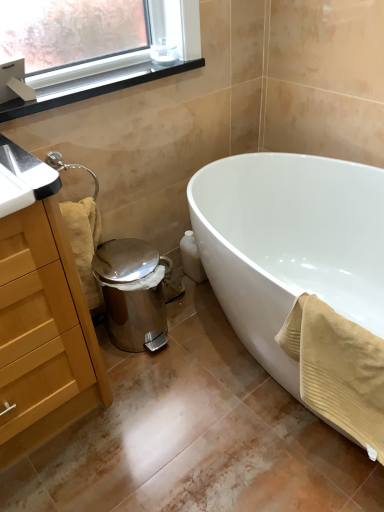
I want to click on wooden cabinet at left, so click(x=43, y=330).

Measure the distance between point (54,426) and camera.

1.43 meters.

At what (x,y) coordinates should I click in order to perform the action: click on black plastic window sill at upper left. Please return your answer as a coordinate pair (x, y). Looking at the image, I should click on (93, 87).

In order to face black plastic window sill at upper left, should I rotate leftwards or rightwards?

To align with it, rotate left about 11.834°.

Describe the element at coordinates (84, 243) in the screenshot. The width and height of the screenshot is (384, 512). I see `beige textured towel at lower left, positioned as the second bath towel in front-to-back order` at that location.

The image size is (384, 512). What are the coordinates of `wooden cabinet at left` in the screenshot? It's located at (43, 330).

Does white glossy bathtub at lower right have a smaller size compared to black plastic window sill at upper left?

Actually, white glossy bathtub at lower right might be larger than black plastic window sill at upper left.

Between point (288, 326) and point (159, 70), which one is positioned behind?

The point (159, 70) is more distant.

Considering the relative positions of white glossy bathtub at lower right and black plastic window sill at upper left in the image provided, is white glossy bathtub at lower right to the left of black plastic window sill at upper left from the viewer's perspective?

Incorrect, white glossy bathtub at lower right is not on the left side of black plastic window sill at upper left.

From the image's perspective, which object appears higher, white glossy bathtub at lower right or black plastic window sill at upper left?

black plastic window sill at upper left is shown above in the image.

How far apart are black plastic window sill at upper left and wooden cabinet at left?

black plastic window sill at upper left is 26.18 inches away from wooden cabinet at left.

In terms of width, does black plastic window sill at upper left look wider or thinner when compared to wooden cabinet at left?

In the image, black plastic window sill at upper left appears to be more narrow than wooden cabinet at left.

From a real-world perspective, between black plastic window sill at upper left and wooden cabinet at left, who is vertically lower?

From a 3D spatial view, wooden cabinet at left is below.

Is black plastic window sill at upper left next to wooden cabinet at left?

black plastic window sill at upper left is not next to wooden cabinet at left, and they're not touching.

Is point (370, 356) positioned after point (183, 68)?

No, it is not.

Is beige textured towel at lower right, placed as the first bath towel when sorted from right to left, next to black plastic window sill at upper left?

No.

From the image's perspective, which is above, wooden cabinet at left or white glossy bathtub at lower right?

white glossy bathtub at lower right.

Would you say wooden cabinet at left is inside or outside white glossy bathtub at lower right?

wooden cabinet at left lies outside white glossy bathtub at lower right.

How far apart are wooden cabinet at left and white glossy bathtub at lower right?

wooden cabinet at left is 28.67 inches from white glossy bathtub at lower right.

Between wooden cabinet at left and white glossy bathtub at lower right, which one has smaller width?

wooden cabinet at left is thinner.

From the image's perspective, is black plastic window sill at upper left over white glossy bathtub at lower right?

Yes, from the image's perspective, black plastic window sill at upper left is above white glossy bathtub at lower right.

Looking at this image, from a real-world perspective, is black plastic window sill at upper left physically located above or below white glossy bathtub at lower right?

black plastic window sill at upper left is above white glossy bathtub at lower right.

Is black plastic window sill at upper left positioned behind white glossy bathtub at lower right?

Yes, black plastic window sill at upper left is behind white glossy bathtub at lower right.

Who is shorter, black plastic window sill at upper left or white glossy bathtub at lower right?

With less height is black plastic window sill at upper left.

Which of these two, beige textured towel at lower left, the first bath towel from the left, or wooden cabinet at left, is bigger?

With larger size is wooden cabinet at left.

Is beige textured towel at lower left, the first bath towel positioned from the back, turned away from wooden cabinet at left?

No.

From a real-world perspective, is beige textured towel at lower left, which is the 2th bath towel from right to left, below wooden cabinet at left?

Yes, from a real-world perspective, beige textured towel at lower left, which is the 2th bath towel from right to left, is beneath wooden cabinet at left.

Is point (279, 334) closer to camera compared to point (226, 312)?

Yes, it is.

Considering the relative sizes of beige textured towel at lower right, which appears as the 2th bath towel when viewed from the back, and white glossy bathtub at lower right in the image provided, is beige textured towel at lower right, which appears as the 2th bath towel when viewed from the back, smaller than white glossy bathtub at lower right?

Yes.

Is beige textured towel at lower right, the second bath towel in the left-to-right sequence, positioned in front of white glossy bathtub at lower right?

Yes.

Between beige textured towel at lower right, the second bath towel in the left-to-right sequence, and white glossy bathtub at lower right, which one has less height?

beige textured towel at lower right, the second bath towel in the left-to-right sequence.

Locate an element on the screen. window sill on the left of white glossy bathtub at lower right is located at coordinates (93, 87).

At what (x,y) coordinates should I click in order to perform the action: click on window sill above the wooden cabinet at left (from a real-world perspective). Please return your answer as a coordinate pair (x, y). The height and width of the screenshot is (512, 384). Looking at the image, I should click on 93,87.

When comparing their distances from beige textured towel at lower right, which appears as the 2th bath towel when viewed from the back, does white glossy bathtub at lower right or beige textured towel at lower left, the first bath towel positioned from the back, seem further?

beige textured towel at lower left, the first bath towel positioned from the back.

When comparing their distances from black plastic window sill at upper left, does beige textured towel at lower left, the first bath towel positioned from the back, or white glossy bathtub at lower right seem further?

white glossy bathtub at lower right lies further to black plastic window sill at upper left than the other object.

Estimate the real-world distances between objects in this image. Which object is further from beige textured towel at lower left, the first bath towel positioned from the back, beige textured towel at lower right, the second bath towel in the left-to-right sequence, or wooden cabinet at left?

beige textured towel at lower right, the second bath towel in the left-to-right sequence.

Looking at the image, which one is located closer to black plastic window sill at upper left, beige textured towel at lower left, which is the 2th bath towel from right to left, or wooden cabinet at left?

Based on the image, beige textured towel at lower left, which is the 2th bath towel from right to left, appears to be nearer to black plastic window sill at upper left.

Looking at the image, which one is located further to wooden cabinet at left, beige textured towel at lower right, which appears as the 2th bath towel when viewed from the back, or beige textured towel at lower left, positioned as the second bath towel in front-to-back order?

beige textured towel at lower right, which appears as the 2th bath towel when viewed from the back, is positioned further to the anchor wooden cabinet at left.

From the image, which object appears to be farther from beige textured towel at lower left, the first bath towel from the left, wooden cabinet at left or beige textured towel at lower right, placed as the first bath towel when sorted from right to left?

Among the two, beige textured towel at lower right, placed as the first bath towel when sorted from right to left, is located further to beige textured towel at lower left, the first bath towel from the left.

Looking at the image, which one is located closer to wooden cabinet at left, black plastic window sill at upper left or white glossy bathtub at lower right?

The object closer to wooden cabinet at left is black plastic window sill at upper left.

Based on their spatial positions, is black plastic window sill at upper left or beige textured towel at lower right, which appears as the 2th bath towel when viewed from the back, further from beige textured towel at lower left, positioned as the second bath towel in front-to-back order?

The object further to beige textured towel at lower left, positioned as the second bath towel in front-to-back order, is beige textured towel at lower right, which appears as the 2th bath towel when viewed from the back.

The height and width of the screenshot is (512, 384). I want to click on bathtub between black plastic window sill at upper left and beige textured towel at lower right, placed as the first bath towel when sorted from right to left, in the vertical direction, so click(302, 276).

You are a GUI agent. You are given a task and a screenshot of the screen. Output one action in this format:
    pyautogui.click(x=<x>, y=<y>)
    Task: Click on the bath towel between beige textured towel at lower left, the first bath towel from the left, and white glossy bathtub at lower right, in the horizontal direction
    This screenshot has height=512, width=384.
    Given the screenshot: What is the action you would take?
    pyautogui.click(x=338, y=369)

Find the location of a particular element. cabinetry between black plastic window sill at upper left and beige textured towel at lower right, which appears as the 2th bath towel when viewed from the back, from top to bottom is located at coordinates (43, 330).

Find the location of a particular element. window sill between wooden cabinet at left and white glossy bathtub at lower right is located at coordinates (93, 87).